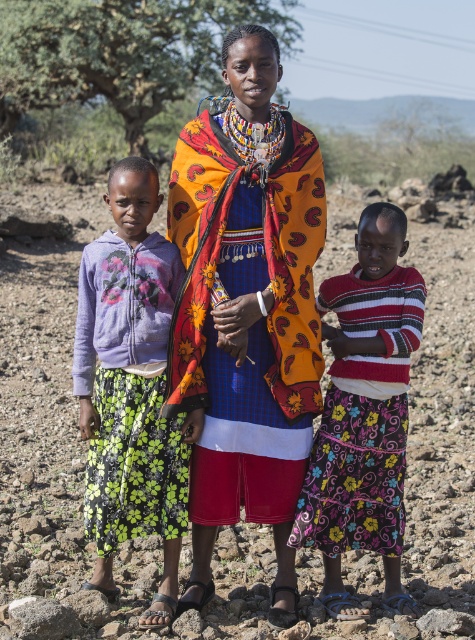
Can you confirm if dull brown soil at center is taller than vibrant woven fabric at center?

Indeed, dull brown soil at center has a greater height compared to vibrant woven fabric at center.

Identify the location of dull brown soil at center. (54, 442).

Which is more to the left, dull brown soil at center or purple floral skirt at left?

From the viewer's perspective, purple floral skirt at left appears more on the left side.

Is dull brown soil at center to the left of purple floral skirt at left from the viewer's perspective?

No, dull brown soil at center is not to the left of purple floral skirt at left.

Who is more distant from viewer, (311, 609) or (84, 300)?

Point (84, 300)

Where is `dull brown soil at center`? Image resolution: width=475 pixels, height=640 pixels. dull brown soil at center is located at coordinates (54, 442).

Can you confirm if purple floral skirt at left is positioned above striped knit sweater at center?

Yes, purple floral skirt at left is above striped knit sweater at center.

Identify the location of purple floral skirt at left. (130, 385).

The width and height of the screenshot is (475, 640). Identify the location of purple floral skirt at left. (130, 385).